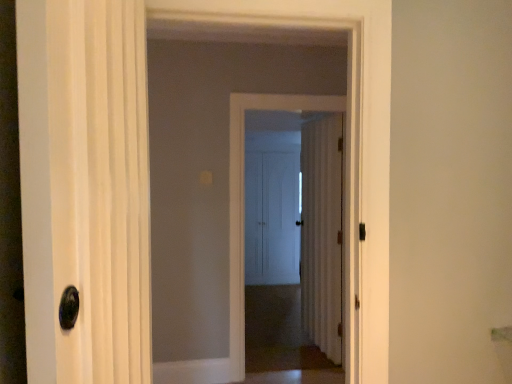
Question: Considering the positions of white glossy door at center and brown carpet at center in the image, is white glossy door at center taller or shorter than brown carpet at center?

Choices:
 (A) tall
 (B) short

Answer: (A)

Question: Is white glossy door at center to the left or to the right of brown carpet at center in the image?

Choices:
 (A) left
 (B) right

Answer: (A)

Question: Estimate the real-world distances between objects in this image. Which object is closer to the white matte door at center, arranged as the 1th door when viewed from the back?

Choices:
 (A) white glossy door at center
 (B) brown carpet at center
 (C) white wood door at center, which is counted as the 2th door, starting from the back
 (D) white glossy door at left, the 1th door in the front-to-back sequence
 (E) white matte door at center, the 3th door from the back

Answer: (B)

Question: Which object is positioned closest to the white matte door at center, which appears as the second door when viewed from the front?

Choices:
 (A) white matte door at center, arranged as the 1th door when viewed from the back
 (B) white glossy door at left, the 1th door in the front-to-back sequence
 (C) white wood door at center, acting as the 3th door starting from the front
 (D) white glossy door at center
 (E) brown carpet at center

Answer: (D)